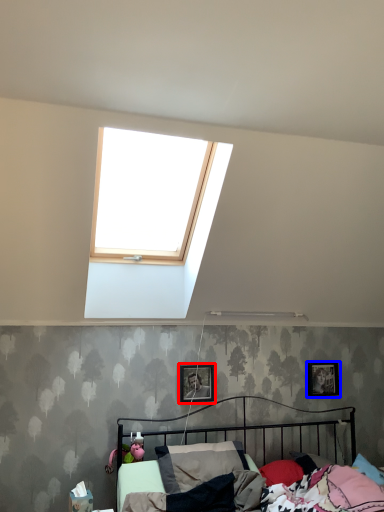
Question: Which object appears farthest to the camera in this image, picture frame (highlighted by a red box) or picture frame (highlighted by a blue box)?

Choices:
 (A) picture frame
 (B) picture frame

Answer: (B)